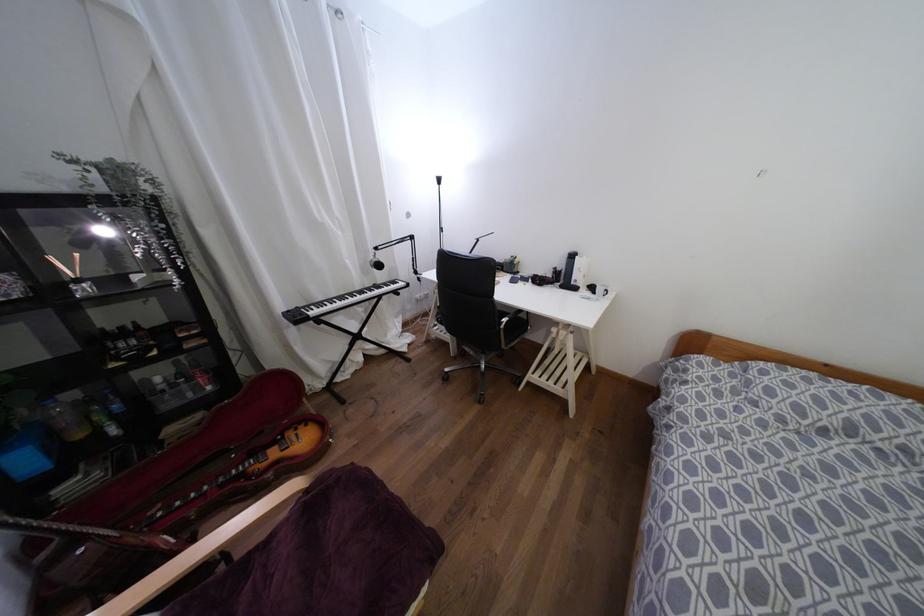
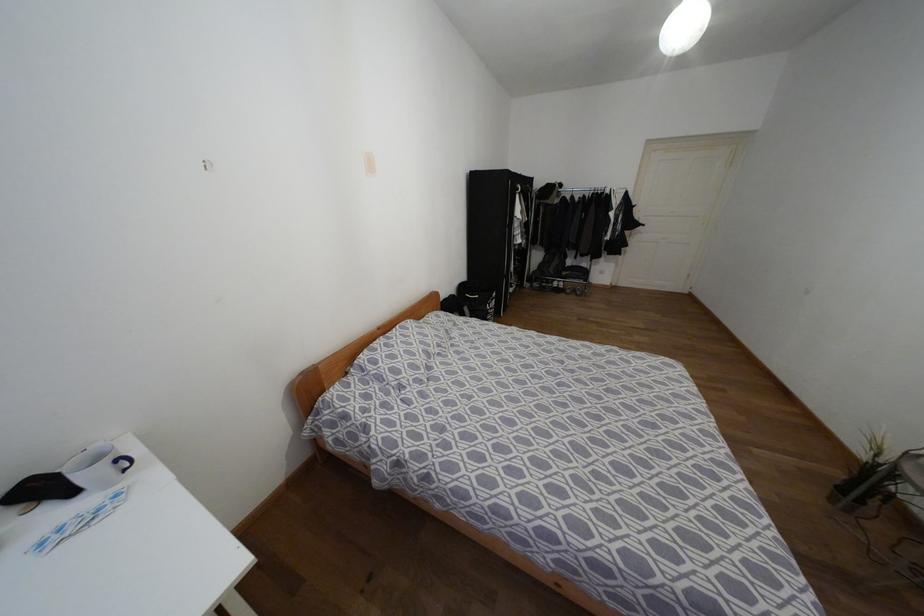
First-person continuous shooting, in which direction is the camera rotating?

The rotation direction of the camera is right-down.